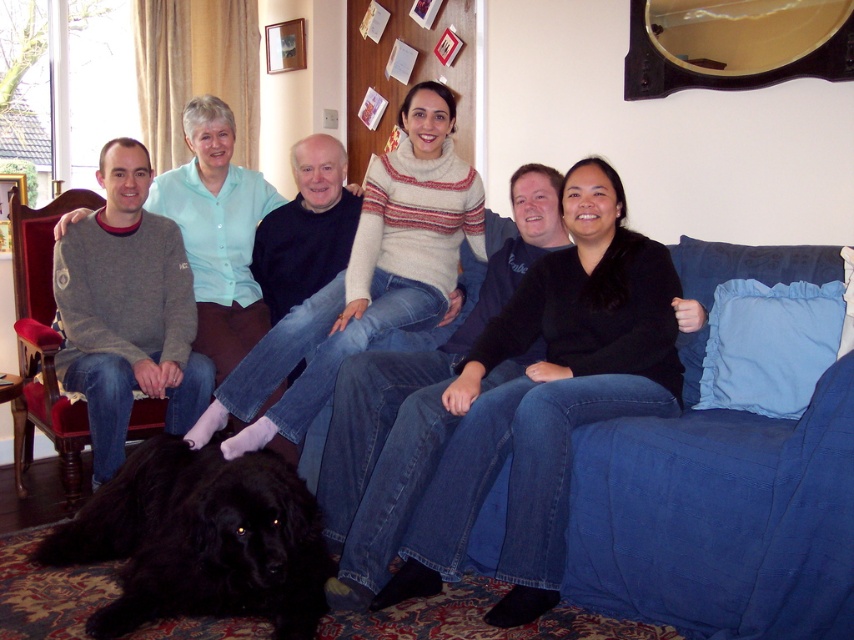
Can you confirm if matte black dog at lower left is positioned to the right of wooden armchair at left?

Indeed, matte black dog at lower left is positioned on the right side of wooden armchair at left.

Who is shorter, matte black dog at lower left or wooden armchair at left?

With less height is wooden armchair at left.

Is point (389, 440) closer to camera compared to point (30, 381)?

Yes.

Where is `matte black dog at lower left`? The height and width of the screenshot is (640, 854). matte black dog at lower left is located at coordinates (303, 225).

Find the location of a particular element. Image resolution: width=854 pixels, height=640 pixels. light blue sweater at center is located at coordinates (366, 280).

Who is shorter, light blue sweater at center or wooden armchair at left?

wooden armchair at left is shorter.

Between point (244, 372) and point (20, 314), which one is positioned in front?

Point (244, 372)

Find the location of a particular element. The image size is (854, 640). light blue sweater at center is located at coordinates (366, 280).

Is matte black dog at lower left taller than light blue sweater at center?

Correct, matte black dog at lower left is much taller as light blue sweater at center.

Which is more to the right, matte black dog at lower left or light blue sweater at center?

matte black dog at lower left is more to the right.

Describe the element at coordinates (303, 225) in the screenshot. I see `matte black dog at lower left` at that location.

The height and width of the screenshot is (640, 854). In order to click on matte black dog at lower left in this screenshot , I will do `click(303, 225)`.